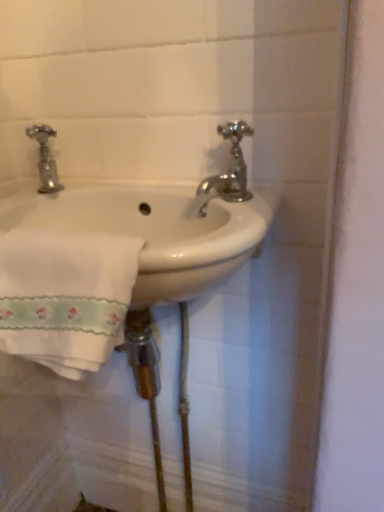
Question: Considering the relative sizes of polished chrome faucet at upper right and white ceramic sink at center in the image provided, is polished chrome faucet at upper right taller than white ceramic sink at center?

Choices:
 (A) yes
 (B) no

Answer: (B)

Question: Is polished chrome faucet at upper right wider than white ceramic sink at center?

Choices:
 (A) yes
 (B) no

Answer: (B)

Question: Can you confirm if polished chrome faucet at upper right is thinner than white ceramic sink at center?

Choices:
 (A) yes
 (B) no

Answer: (A)

Question: From the image's perspective, would you say polished chrome faucet at upper right is positioned over white ceramic sink at center?

Choices:
 (A) yes
 (B) no

Answer: (A)

Question: Is polished chrome faucet at upper right positioned in front of white ceramic sink at center?

Choices:
 (A) yes
 (B) no

Answer: (B)

Question: From the image's perspective, relative to polished chrome faucet at upper right, is white embroidered towel at lower left above or below?

Choices:
 (A) below
 (B) above

Answer: (A)

Question: Is point (76, 250) positioned closer to the camera than point (246, 175)?

Choices:
 (A) farther
 (B) closer

Answer: (B)

Question: In terms of height, does white embroidered towel at lower left look taller or shorter compared to polished chrome faucet at upper right?

Choices:
 (A) short
 (B) tall

Answer: (B)

Question: Do you think white embroidered towel at lower left is within polished chrome faucet at upper right, or outside of it?

Choices:
 (A) outside
 (B) inside

Answer: (A)

Question: Visually, is polished chrome faucet at upper right positioned to the left or to the right of white embroidered towel at lower left?

Choices:
 (A) left
 (B) right

Answer: (B)

Question: Considering the positions of polished chrome faucet at upper right and white embroidered towel at lower left in the image, is polished chrome faucet at upper right bigger or smaller than white embroidered towel at lower left?

Choices:
 (A) small
 (B) big

Answer: (A)

Question: In terms of height, does polished chrome faucet at upper right look taller or shorter compared to white embroidered towel at lower left?

Choices:
 (A) tall
 (B) short

Answer: (B)

Question: Considering their positions, is polished chrome faucet at upper right located in front of or behind white embroidered towel at lower left?

Choices:
 (A) front
 (B) behind

Answer: (B)

Question: Is point (152, 239) positioned closer to the camera than point (231, 180)?

Choices:
 (A) closer
 (B) farther

Answer: (B)

Question: Would you say white ceramic sink at center is to the left or to the right of polished chrome faucet at upper right in the picture?

Choices:
 (A) right
 (B) left

Answer: (B)